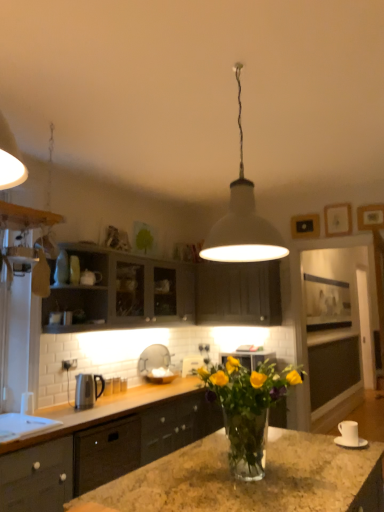
Where is `vacant area in front of satin black kettle at left, the 2th appliance viewed from the front`? Image resolution: width=384 pixels, height=512 pixels. vacant area in front of satin black kettle at left, the 2th appliance viewed from the front is located at coordinates (96, 410).